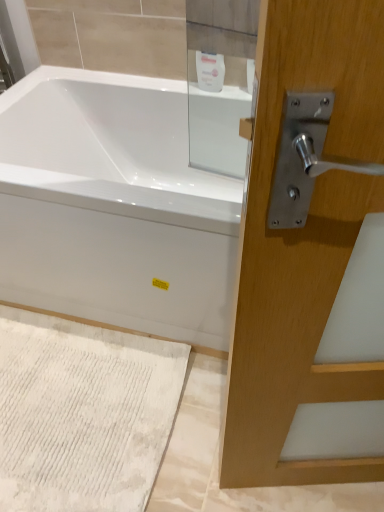
The image size is (384, 512). What do you see at coordinates (210, 71) in the screenshot?
I see `white glossy soap dispenser at upper center` at bounding box center [210, 71].

The height and width of the screenshot is (512, 384). What do you see at coordinates (82, 413) in the screenshot?
I see `white textured bath mat at lower left` at bounding box center [82, 413].

This screenshot has width=384, height=512. I want to click on white glossy soap dispenser at upper center, so click(x=210, y=71).

This screenshot has width=384, height=512. What are the coordinates of `bathtub in front of the white textured bath mat at lower left` in the screenshot? It's located at (114, 207).

How many degrees apart are the facing directions of white glossy bathtub at center and white textured bath mat at lower left?

There is a 0.23-degree angle between the facing directions of white glossy bathtub at center and white textured bath mat at lower left.

From a real-world perspective, which is physically above, white glossy bathtub at center or white textured bath mat at lower left?

white glossy bathtub at center, from a real-world perspective.

Is white glossy bathtub at center positioned in front of white textured bath mat at lower left?

Yes, white glossy bathtub at center is closer to the viewer.

Who is smaller, white textured bath mat at lower left or white glossy soap dispenser at upper center?

With smaller size is white glossy soap dispenser at upper center.

Does point (17, 430) lie in front of point (217, 67)?

Yes, point (17, 430) is closer to viewer.

How different are the orientations of white textured bath mat at lower left and white glossy soap dispenser at upper center in degrees?

There is a 0.799-degree angle between the facing directions of white textured bath mat at lower left and white glossy soap dispenser at upper center.

From a real-world perspective, is white textured bath mat at lower left positioned over white glossy soap dispenser at upper center based on gravity?

Actually, white textured bath mat at lower left is physically below white glossy soap dispenser at upper center in the real world.

Is white textured bath mat at lower left directly adjacent to white glossy bathtub at center?

No, white textured bath mat at lower left is not touching white glossy bathtub at center.

Would you say white textured bath mat at lower left contains white glossy bathtub at center?

No, white glossy bathtub at center is not inside white textured bath mat at lower left.

Is point (56, 498) farther from viewer compared to point (181, 101)?

No, (56, 498) is closer to viewer.

Is white textured bath mat at lower left further to the viewer compared to white glossy bathtub at center?

Yes.

Which is more to the right, white glossy soap dispenser at upper center or white glossy bathtub at center?

white glossy soap dispenser at upper center is more to the right.

Which is in front, point (204, 79) or point (202, 304)?

The point (202, 304) is closer to the camera.

Which is correct: white glossy soap dispenser at upper center is inside white glossy bathtub at center, or outside of it?

white glossy soap dispenser at upper center is outside white glossy bathtub at center.

From a real-world perspective, is white glossy soap dispenser at upper center positioned over white glossy bathtub at center based on gravity?

Yes, from a real-world perspective, white glossy soap dispenser at upper center is on top of white glossy bathtub at center.

Is point (97, 175) closer or farther from the camera than point (219, 75)?

Point (97, 175).

From a real-world perspective, is white glossy bathtub at center beneath white glossy soap dispenser at upper center?

Yes, from a real-world perspective, white glossy bathtub at center is beneath white glossy soap dispenser at upper center.

Is white glossy bathtub at center oriented towards white glossy soap dispenser at upper center?

No, white glossy bathtub at center is not turned towards white glossy soap dispenser at upper center.

Considering the sizes of objects white glossy soap dispenser at upper center and white textured bath mat at lower left in the image provided, who is smaller, white glossy soap dispenser at upper center or white textured bath mat at lower left?

white glossy soap dispenser at upper center.

Who is shorter, white glossy soap dispenser at upper center or white textured bath mat at lower left?

Standing shorter between the two is white textured bath mat at lower left.

From the image's perspective, is white glossy soap dispenser at upper center beneath white textured bath mat at lower left?

No.

Can you confirm if white glossy soap dispenser at upper center is wider than white textured bath mat at lower left?

Incorrect, the width of white glossy soap dispenser at upper center does not surpass that of white textured bath mat at lower left.

Locate an element on the screen. The height and width of the screenshot is (512, 384). bathtub above the white textured bath mat at lower left (from a real-world perspective) is located at coordinates (114, 207).

At what (x,y) coordinates should I click in order to perform the action: click on toiletry located behind the white textured bath mat at lower left. Please return your answer as a coordinate pair (x, y). Looking at the image, I should click on (210, 71).

Which object lies nearer to the anchor point white glossy bathtub at center, white textured bath mat at lower left or white glossy soap dispenser at upper center?

white textured bath mat at lower left lies closer to white glossy bathtub at center than the other object.

From the image, which object appears to be nearer to white glossy soap dispenser at upper center, white glossy bathtub at center or white textured bath mat at lower left?

Based on the image, white glossy bathtub at center appears to be nearer to white glossy soap dispenser at upper center.

From the image, which object appears to be farther from white textured bath mat at lower left, white glossy bathtub at center or white glossy soap dispenser at upper center?

white glossy soap dispenser at upper center is positioned further to the anchor white textured bath mat at lower left.

Which object lies further to the anchor point white glossy soap dispenser at upper center, white textured bath mat at lower left or white glossy bathtub at center?

white textured bath mat at lower left.

Considering their positions, is white glossy soap dispenser at upper center positioned further to white textured bath mat at lower left than white glossy bathtub at center?

white glossy soap dispenser at upper center lies further to white textured bath mat at lower left than the other object.

When comparing their distances from white glossy bathtub at center, does white glossy soap dispenser at upper center or white textured bath mat at lower left seem further?

white glossy soap dispenser at upper center is further to white glossy bathtub at center.

Where is `bathtub between white glossy soap dispenser at upper center and white textured bath mat at lower left vertically`? Image resolution: width=384 pixels, height=512 pixels. bathtub between white glossy soap dispenser at upper center and white textured bath mat at lower left vertically is located at coordinates (114, 207).